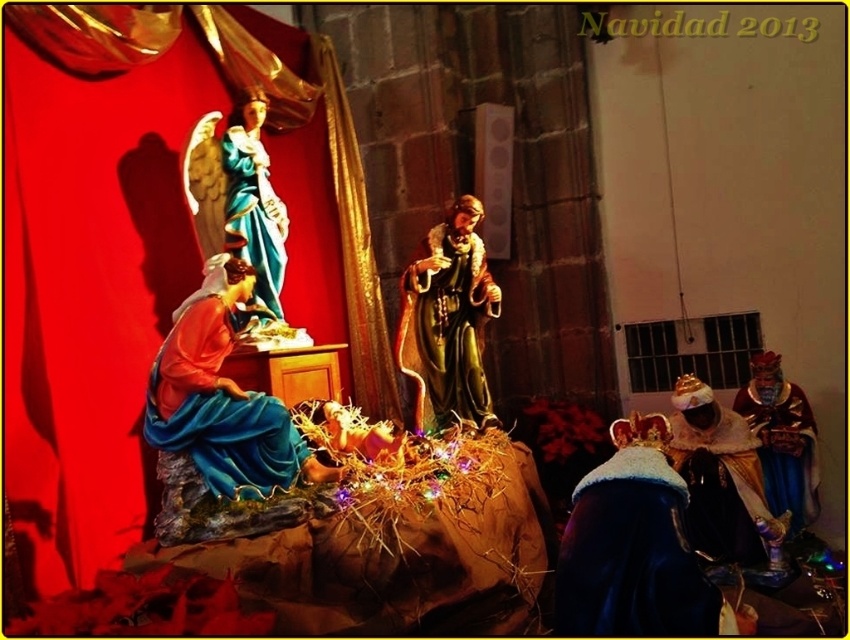
Question: Which is nearer to the gold textured crown at lower right?

Choices:
 (A) matte blue statue at upper left
 (B) matte blue fabric at center
 (C) shiny gold statue at center

Answer: (C)

Question: Does matte blue fabric at center appear on the right side of gold textured crown at lower right?

Choices:
 (A) no
 (B) yes

Answer: (A)

Question: Can you confirm if gold textured crown at lower right is bigger than matte blue statue at upper left?

Choices:
 (A) yes
 (B) no

Answer: (A)

Question: Estimate the real-world distances between objects in this image. Which object is farther from the matte blue statue at upper left?

Choices:
 (A) velvet blue robe at center
 (B) gold textured crown at lower right

Answer: (B)

Question: Does shiny gold statue at center have a larger size compared to matte blue statue at upper left?

Choices:
 (A) yes
 (B) no

Answer: (A)

Question: Which object appears farthest from the camera in this image?

Choices:
 (A) shiny gold statue at center
 (B) velvet blue robe at center

Answer: (A)